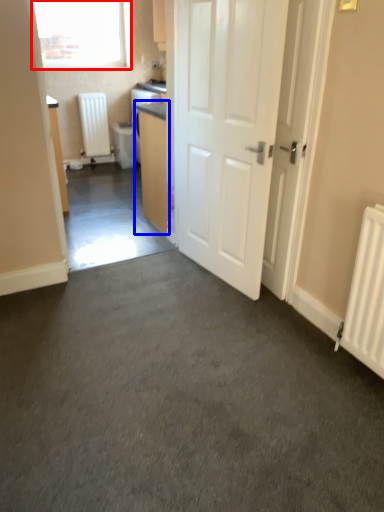
Question: Which object is closer to the camera taking this photo, window (highlighted by a red box) or cabinetry (highlighted by a blue box)?

Choices:
 (A) window
 (B) cabinetry

Answer: (B)